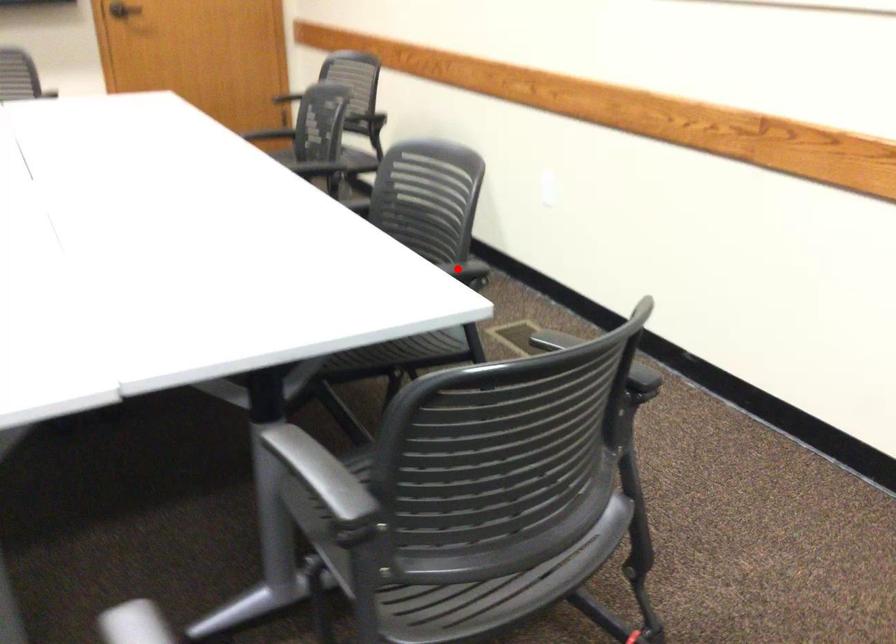
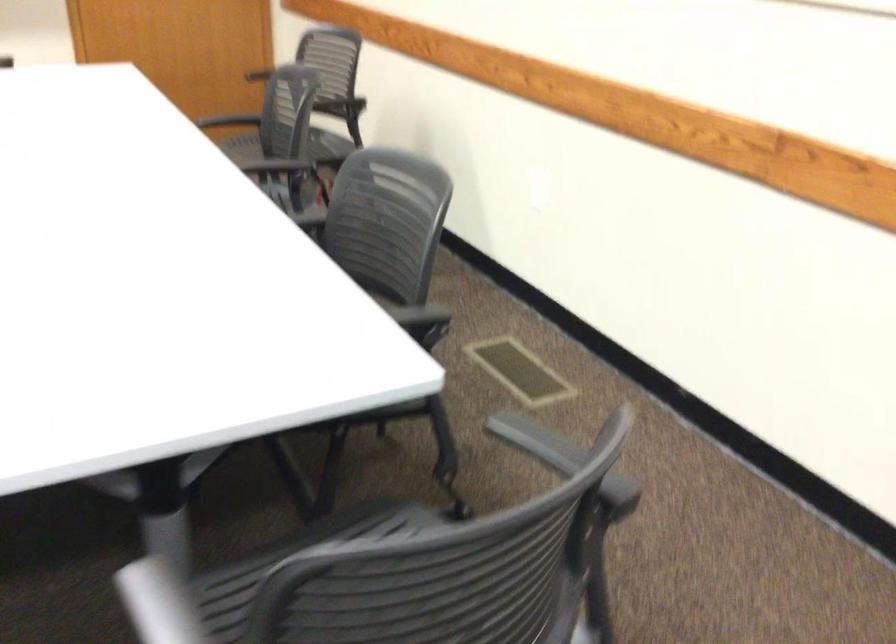
Question: I am providing you with two images of the same scene from different viewpoints. A red point is shown in image1. For the corresponding object point in image2, is it positioned nearer or farther from the camera?

Choices:
 (A) Nearer
 (B) Farther

Answer: (A)